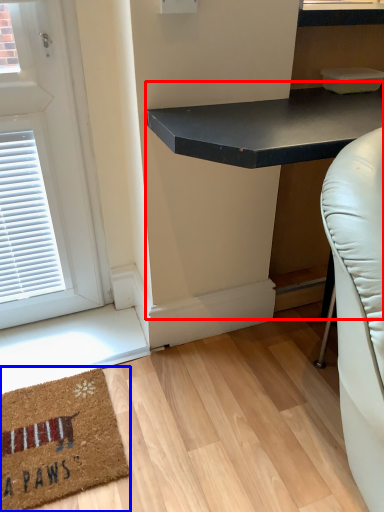
Question: Which object is closer to the camera taking this photo, table (highlighted by a red box) or mat (highlighted by a blue box)?

Choices:
 (A) table
 (B) mat

Answer: (A)